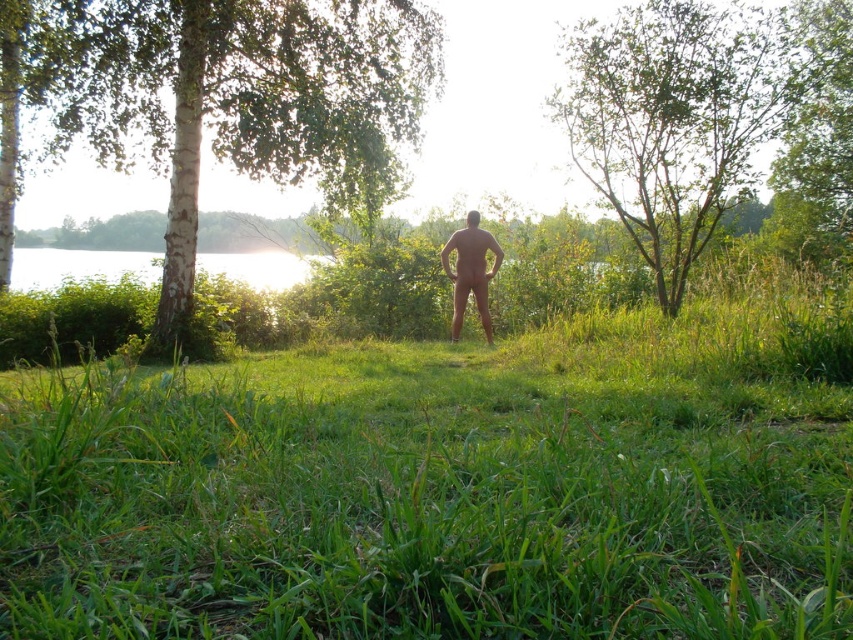
From the picture: Between green grassy at center and white bark tree at left, which one appears on the left side from the viewer's perspective?

Positioned to the left is white bark tree at left.

Between green grassy at center and white bark tree at left, which one appears on the right side from the viewer's perspective?

From the viewer's perspective, green grassy at center appears more on the right side.

At what (x,y) coordinates should I click in order to perform the action: click on green grassy at center. Please return your answer as a coordinate pair (x, y). The image size is (853, 640). Looking at the image, I should click on (428, 496).

Who is positioned more to the left, green leafy tree at upper center or nude human at center?

nude human at center is more to the left.

Does green leafy tree at upper center have a lesser height compared to nude human at center?

Incorrect, green leafy tree at upper center's height does not fall short of nude human at center's.

The image size is (853, 640). What are the coordinates of `green leafy tree at upper center` in the screenshot? It's located at (682, 115).

Locate an element on the screen. The width and height of the screenshot is (853, 640). green leafy tree at upper center is located at coordinates (682, 115).

Can you confirm if white bark tree at left is smaller than green leafy tree at upper center?

Indeed, white bark tree at left has a smaller size compared to green leafy tree at upper center.

Is point (90, 131) less distant than point (672, 304)?

That is False.

At what (x,y) coordinates should I click in order to perform the action: click on white bark tree at left. Please return your answer as a coordinate pair (x, y). Image resolution: width=853 pixels, height=640 pixels. Looking at the image, I should click on (213, 97).